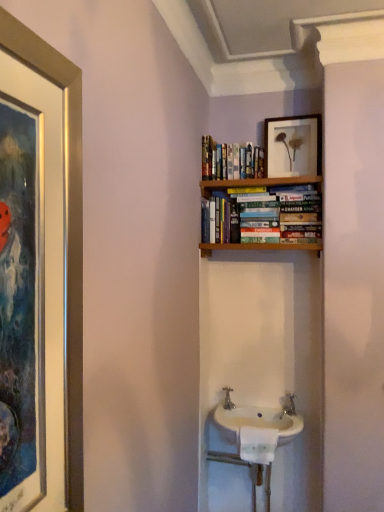
Image resolution: width=384 pixels, height=512 pixels. In order to click on empty space that is to the right of silver metallic tap at center in this screenshot , I will do `click(262, 407)`.